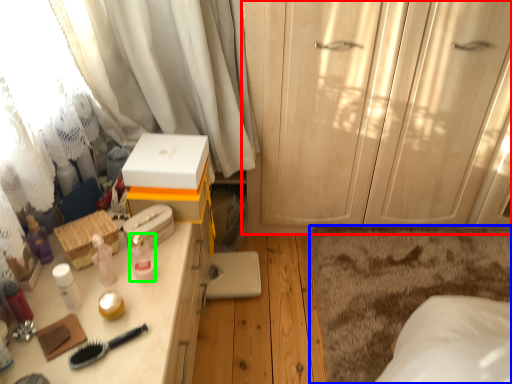
Question: Based on their relative distances, which object is farther from cabinetry (highlighted by a red box)? Choose from plain (highlighted by a blue box) and toiletry (highlighted by a green box).

Choices:
 (A) plain
 (B) toiletry

Answer: (B)